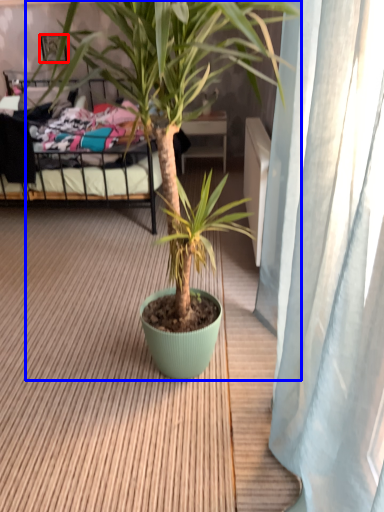
Question: Which object appears closest to the camera in this image, picture frame (highlighted by a red box) or houseplant (highlighted by a blue box)?

Choices:
 (A) picture frame
 (B) houseplant

Answer: (B)